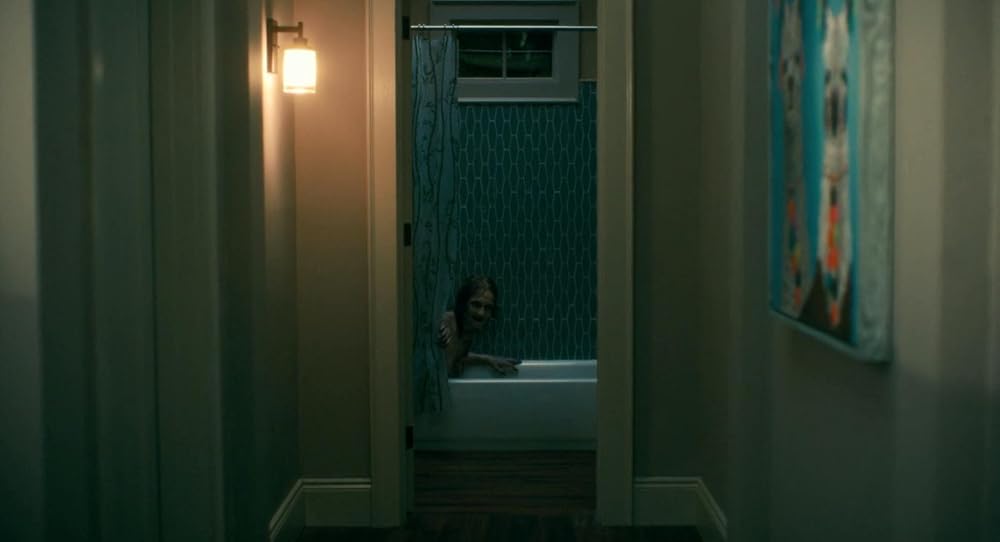
You are a GUI agent. You are given a task and a screenshot of the screen. Output one action in this format:
    pyautogui.click(x=<x>, y=<y>)
    Task: Click on the two dogs in painting
    
    Given the screenshot: What is the action you would take?
    pyautogui.click(x=836, y=116), pyautogui.click(x=789, y=89)